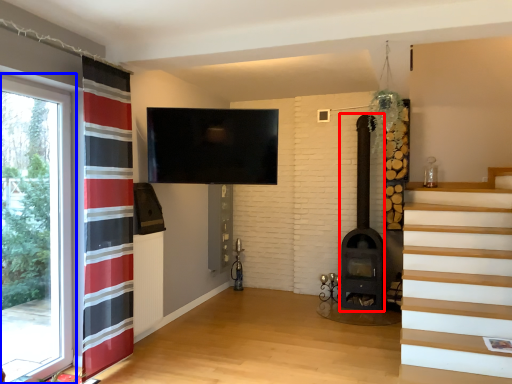
Question: Among these objects, which one is farthest to the camera, fireplace (highlighted by a red box) or window (highlighted by a blue box)?

Choices:
 (A) fireplace
 (B) window

Answer: (A)